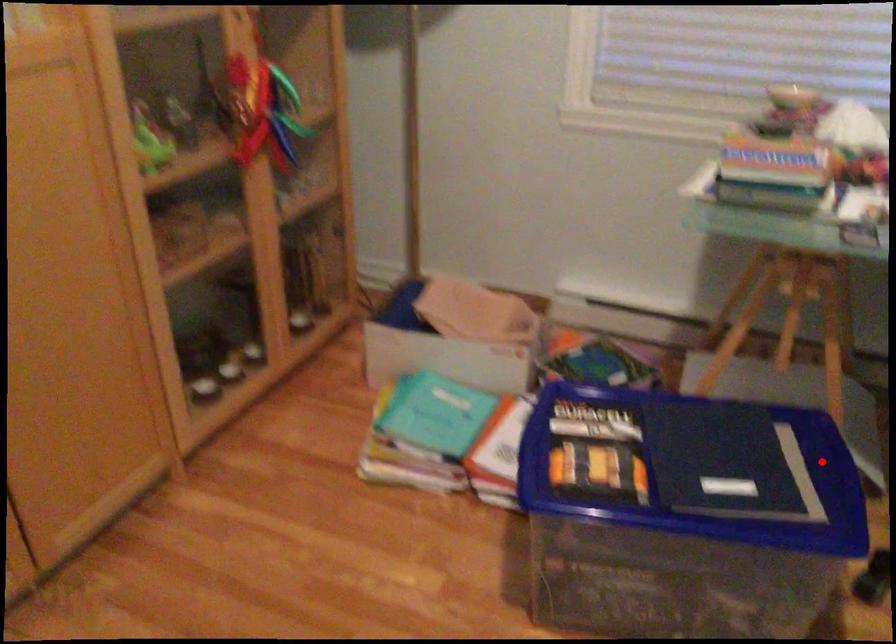
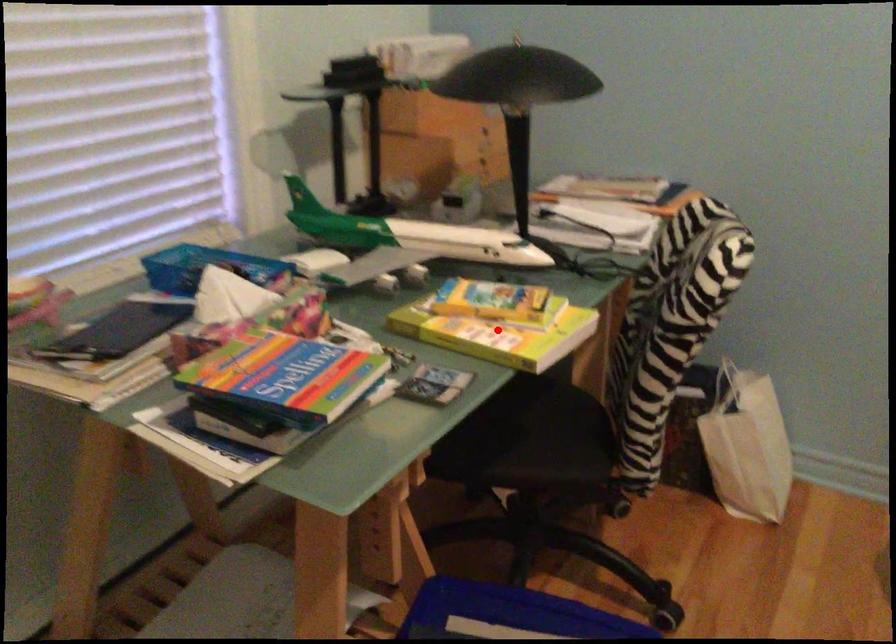
I am providing you with two images of the same scene from different viewpoints. A red point is marked on the first image and another point is marked on the second image. Are the points marked in image1 and image2 representing the same 3D position?

No